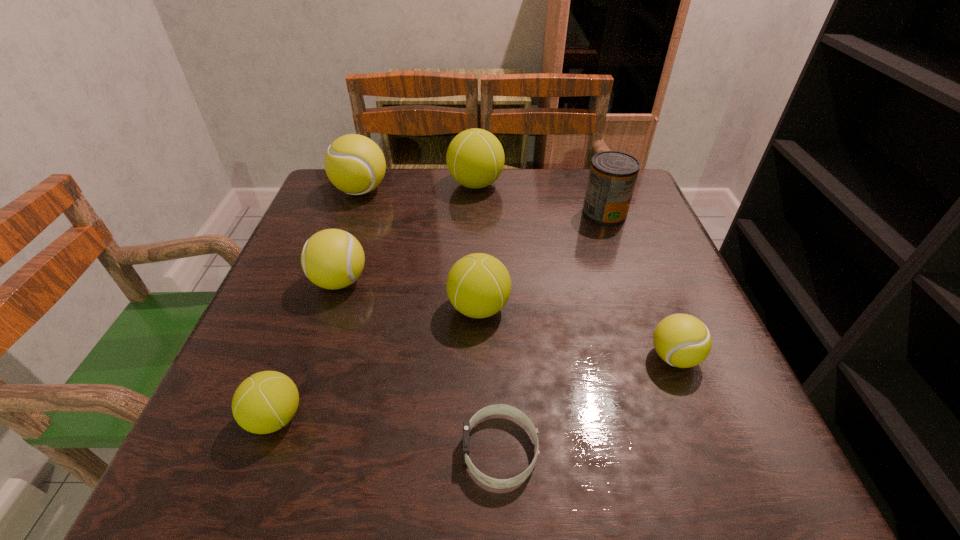
The image size is (960, 540). What are the coordinates of `the farthest yellow tennis ball` in the screenshot? It's located at (354, 164).

At what (x,y) coordinates should I click in order to perform the action: click on the biggest green tennis ball. Please return your answer as a coordinate pair (x, y). Looking at the image, I should click on (475, 158).

Locate an element on the screen. can is located at coordinates (612, 177).

Identify the location of the second nearest yellow tennis ball. (332, 259).

Where is `the second farthest green tennis ball`? the second farthest green tennis ball is located at coordinates (478, 285).

Find the location of a particular element. This screenshot has height=540, width=960. the rightmost tennis ball is located at coordinates (681, 340).

Where is `the fifth farthest tennis ball`? This screenshot has width=960, height=540. the fifth farthest tennis ball is located at coordinates (681, 340).

Image resolution: width=960 pixels, height=540 pixels. I want to click on the nearest tennis ball, so click(x=266, y=401).

The image size is (960, 540). I want to click on the nearest green tennis ball, so click(266, 401).

Where is `the shortest object`? The height and width of the screenshot is (540, 960). the shortest object is located at coordinates (493, 409).